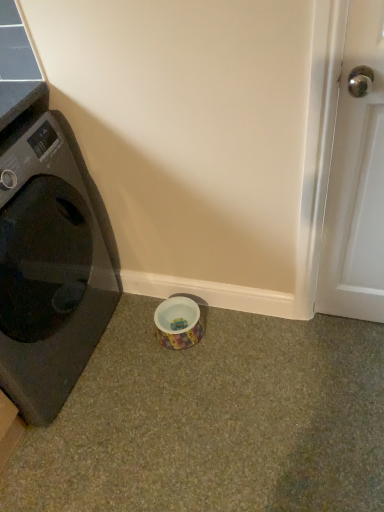
What are the coordinates of `vacant region to the left of multicolored ceramic bowl at lower center` in the screenshot? It's located at (133, 336).